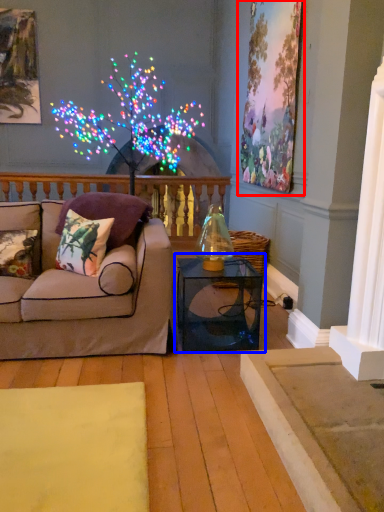
Question: Which object appears farthest to the camera in this image, picture frame (highlighted by a red box) or table (highlighted by a blue box)?

Choices:
 (A) picture frame
 (B) table

Answer: (A)